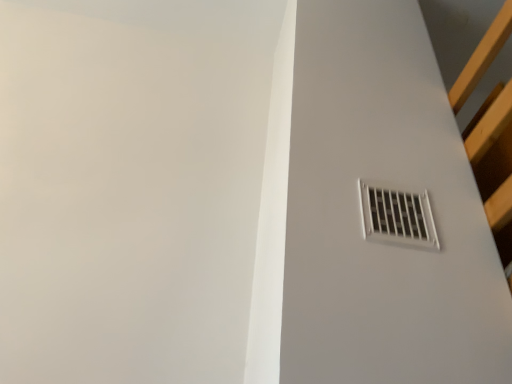
Identify the location of white plastic vent at upper right. (397, 216).

The width and height of the screenshot is (512, 384). Describe the element at coordinates (397, 216) in the screenshot. I see `white plastic vent at upper right` at that location.

Where is `white plastic vent at upper right`? This screenshot has width=512, height=384. white plastic vent at upper right is located at coordinates (397, 216).